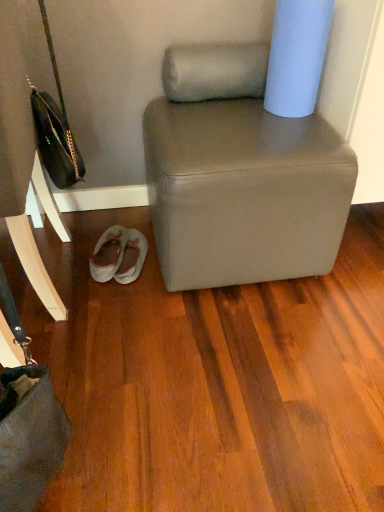
Locate an element on the screen. The height and width of the screenshot is (512, 384). free space to the left of light blue matte toilet paper at upper right is located at coordinates (237, 112).